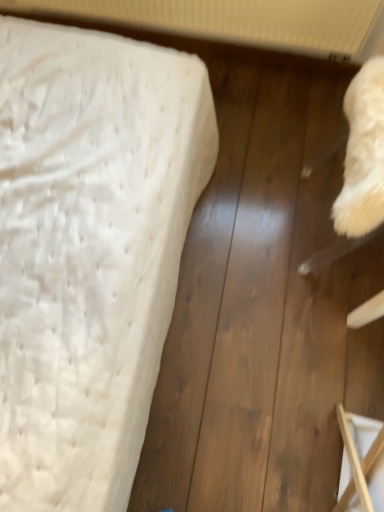
Question: Is white textured mattress at left facing away from wooden frame at lower right?

Choices:
 (A) no
 (B) yes

Answer: (A)

Question: Considering the relative sizes of white textured mattress at left and wooden frame at lower right in the image provided, is white textured mattress at left taller than wooden frame at lower right?

Choices:
 (A) yes
 (B) no

Answer: (B)

Question: Can you confirm if white textured mattress at left is bigger than wooden frame at lower right?

Choices:
 (A) no
 (B) yes

Answer: (B)

Question: Does white textured mattress at left turn towards wooden frame at lower right?

Choices:
 (A) yes
 (B) no

Answer: (B)

Question: Can wooden frame at lower right be found inside white textured mattress at left?

Choices:
 (A) no
 (B) yes

Answer: (A)

Question: Is white textured radiator at upper center situated inside white textured mattress at left or outside?

Choices:
 (A) outside
 (B) inside

Answer: (A)

Question: Considering the positions of white textured radiator at upper center and white textured mattress at left in the image, is white textured radiator at upper center bigger or smaller than white textured mattress at left?

Choices:
 (A) big
 (B) small

Answer: (B)

Question: From a real-world perspective, is white textured radiator at upper center physically located above or below white textured mattress at left?

Choices:
 (A) above
 (B) below

Answer: (A)

Question: From the image's perspective, relative to white textured mattress at left, is white textured radiator at upper center above or below?

Choices:
 (A) below
 (B) above

Answer: (B)

Question: Visually, is wooden frame at lower right positioned to the left or to the right of white textured radiator at upper center?

Choices:
 (A) right
 (B) left

Answer: (A)

Question: From a real-world perspective, is wooden frame at lower right positioned above or below white textured radiator at upper center?

Choices:
 (A) above
 (B) below

Answer: (B)

Question: From the image's perspective, is wooden frame at lower right located above or below white textured radiator at upper center?

Choices:
 (A) below
 (B) above

Answer: (A)

Question: In terms of width, does wooden frame at lower right look wider or thinner when compared to white textured radiator at upper center?

Choices:
 (A) wide
 (B) thin

Answer: (A)

Question: From a real-world perspective, relative to wooden frame at lower right, is white textured radiator at upper center vertically above or below?

Choices:
 (A) below
 (B) above

Answer: (B)

Question: From their relative heights in the image, would you say white textured radiator at upper center is taller or shorter than wooden frame at lower right?

Choices:
 (A) short
 (B) tall

Answer: (A)